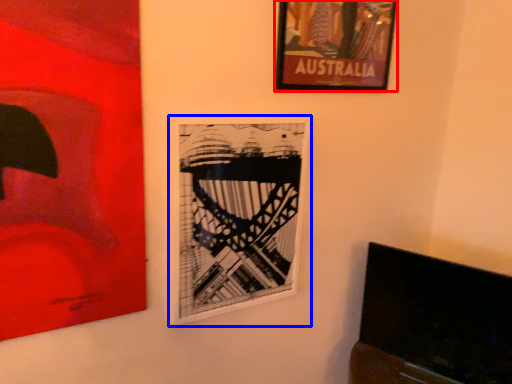
Question: Which point is further to the camera, picture frame (highlighted by a red box) or picture frame (highlighted by a blue box)?

Choices:
 (A) picture frame
 (B) picture frame

Answer: (A)